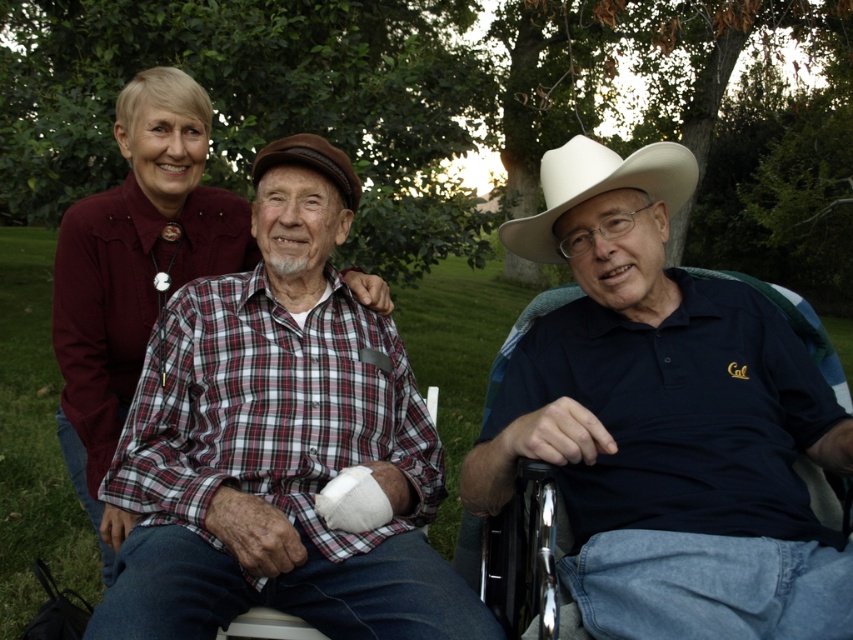
You are taking a photo of the scene and want to ensure both the white matte cowboy hat at upper center and the white felt cowboy hat at center are visible. Which hat should you adjust your camera angle to focus on first if you want to capture the one that is positioned to the right?

The white matte cowboy hat at upper center is to the right of the white felt cowboy hat at center, so you should focus on the white matte cowboy hat at upper center first to capture the one on the right.

You are a photographer setting up a shot of the scene described. You need to ensure that the white matte cowboy hat at upper center does not block the plaid cotton shirt at center in the photo. Based on their sizes, is this possible?

The white matte cowboy hat at upper center might be wider than plaid cotton shirt at center, so there is a possibility that the hat could block the shirt if positioned directly in front of it. Adjust the angle or position to ensure both are visible.

You are a photographer setting up a tripod to take a group photo. You notice the white matte cowboy hat at upper center and the plaid cotton shirt at center. Which object should you adjust to ensure both are fully visible in the frame?

You should adjust the plaid cotton shirt at center because the white matte cowboy hat at upper center is shorter than the plaid cotton shirt at center, so lowering the camera angle or moving the shirt forward might help ensure both are visible.